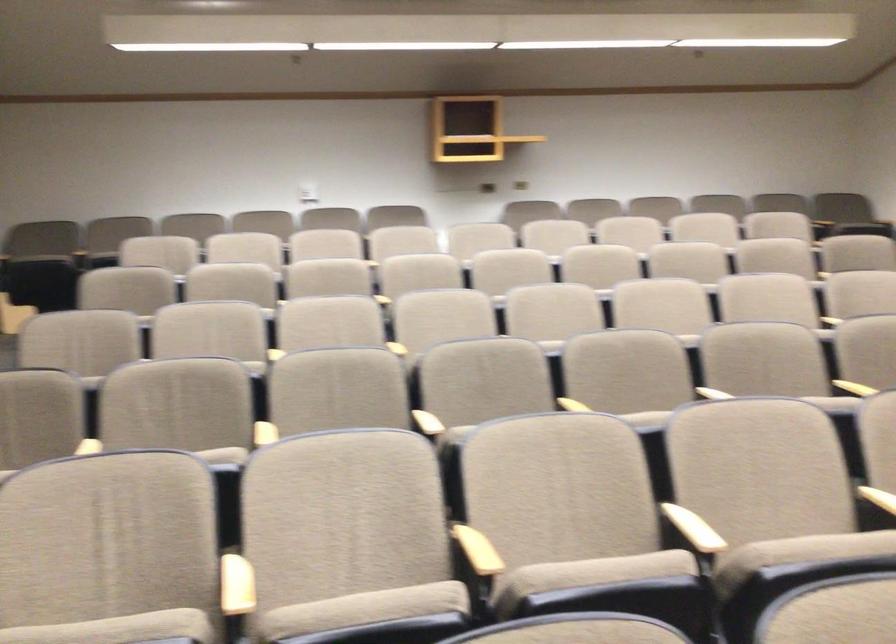
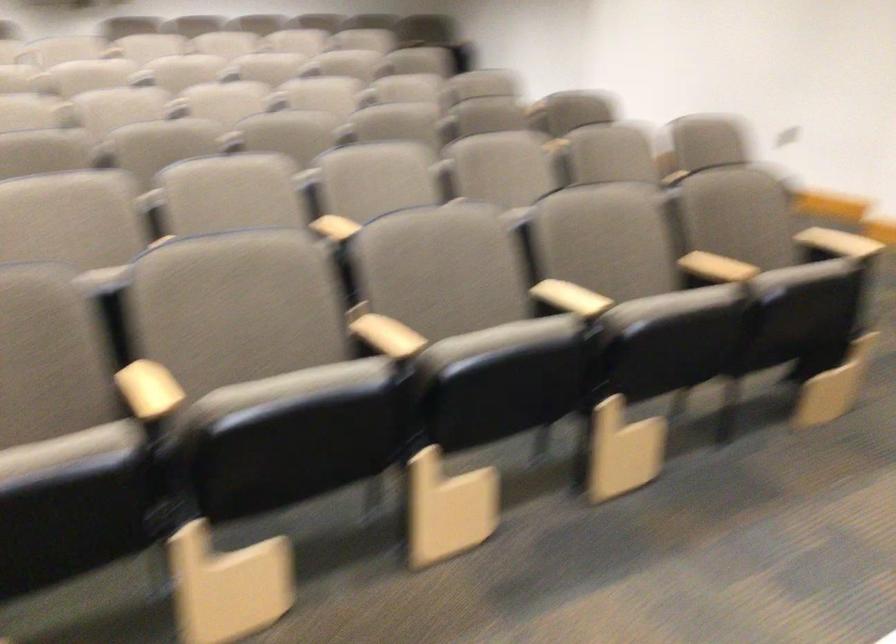
Question: The camera is either moving clockwise (left) or counter-clockwise (right) around the object. The first image is from the beginning of the video and the second image is from the end. Is the camera moving left or right when shooting the video?

Choices:
 (A) Left
 (B) Right

Answer: (A)